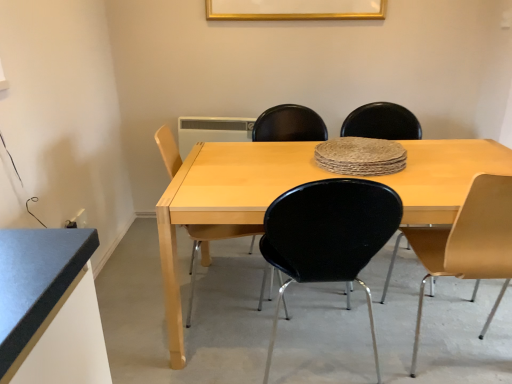
Locate an element on the screen. vacant area that is in front of matte black chair at center, placed as the second chair when sorted from right to left is located at coordinates (389, 301).